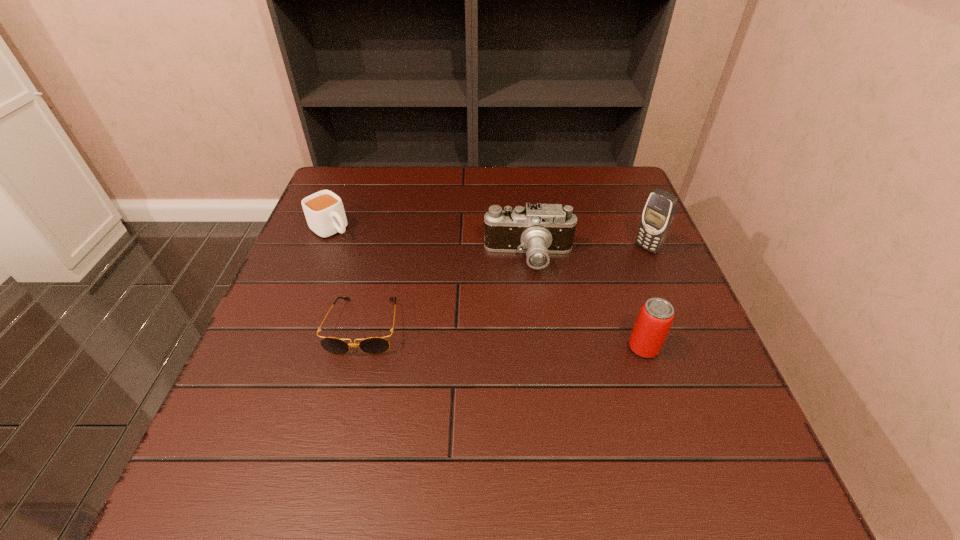
Locate an element on the screen. This screenshot has height=540, width=960. free space on the desktop that is between the sunglasses and the fourth object from left to right and is positioned at the lens of the camera is located at coordinates (516, 338).

Identify the location of free space on the desktop that is between the shortest object and the fourth object from left to right and is positioned on the side with the handle of the leftmost object. (467, 334).

The height and width of the screenshot is (540, 960). In order to click on free space on the desktop that is between the shortest object and the fourth object from left to right and is positioned on the front face of the cellular telephone in this screenshot , I will do `click(526, 339)`.